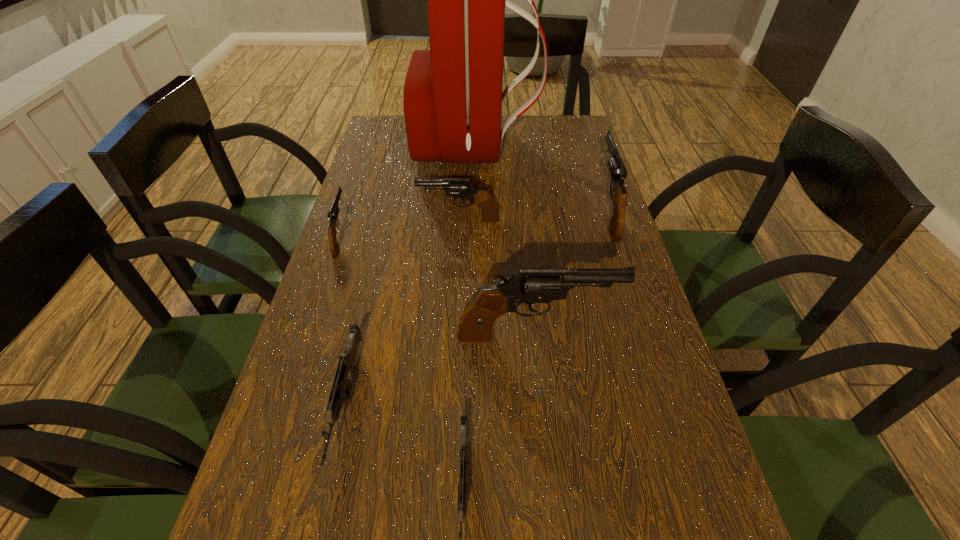
Image resolution: width=960 pixels, height=540 pixels. I want to click on black gun identified as the third closest to the shortest gun, so (x=462, y=188).

At what (x,y) coordinates should I click in order to perform the action: click on black gun that is the closest to the third smallest black gun. Please return your answer as a coordinate pair (x, y). The image size is (960, 540). Looking at the image, I should click on (530, 285).

Select which grey gun is the second closest to the leftmost object. Please provide its 2D coordinates. Your answer should be formatted as a tuple, i.e. [(x, y)], where the tuple contains the x and y coordinates of a point satisfying the conditions above.

[(462, 486)]

Where is `vacant space that satisfies the following two spatial constraints: 1. along the barrel of the fourth shortest object; 2. along the barrel of the rightmost object`? This screenshot has width=960, height=540. vacant space that satisfies the following two spatial constraints: 1. along the barrel of the fourth shortest object; 2. along the barrel of the rightmost object is located at coordinates (460, 210).

I want to click on vacant space that satisfies the following two spatial constraints: 1. along the barrel of the fifth shortest gun; 2. on the strap side of the backpack, so click(x=587, y=147).